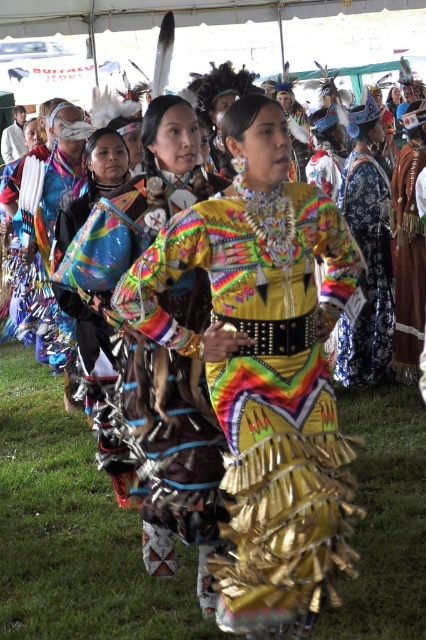
You are a photographer standing at the camera position. You want to take a closeup photo of the shiny metallic dress at center. The camera has a zoom range of up to 5 meters. Can you get a clear closeup without moving closer?

The distance between the shiny metallic dress at center and the camera is 5.27 meters. Since the camera can only zoom up to 5 meters, you cannot get a clear closeup without moving closer.

You are a photographer at the event and want to capture both the multicolored sequined dress at center and the shiny metallic dress at center in the same frame. Which dress should you position to the left side of your camera frame to ensure both are visible?

You should position the multicolored sequined dress at center to the left side of your camera frame because it is already to the left of the shiny metallic dress at center in the scene.

You are at a cultural event and see the shiny metallic dress at center and the shiny metallic bag at center. Which object is taller?

The shiny metallic dress at center is much taller than the shiny metallic bag at center.